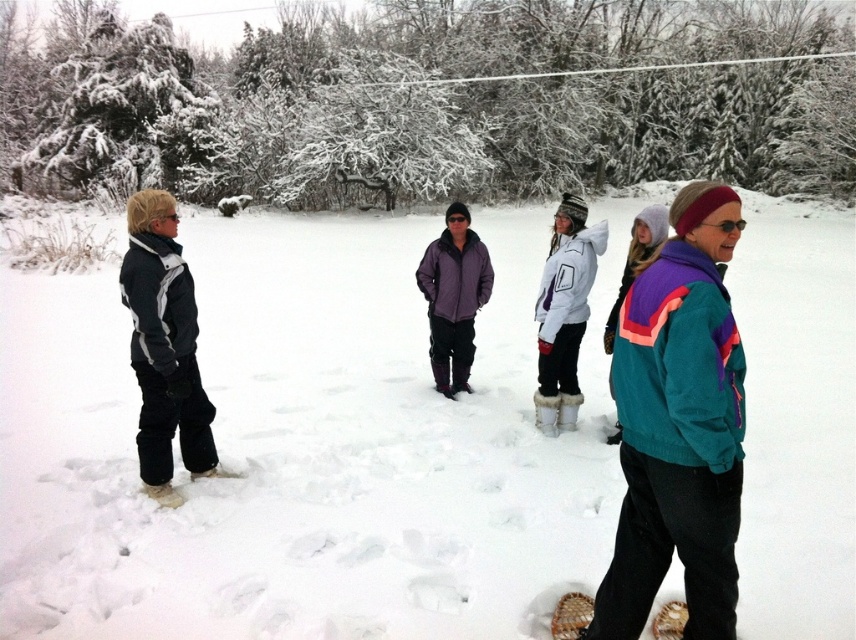
Is purple quilted jacket at center bigger than white fur snowshoe at lower center?

Yes.

Is purple quilted jacket at center wider than white fur snowshoe at lower center?

Yes, purple quilted jacket at center is wider than white fur snowshoe at lower center.

Between point (443, 282) and point (562, 416), which one is positioned in front?

Point (562, 416)

Locate an element on the screen. Image resolution: width=856 pixels, height=640 pixels. purple quilted jacket at center is located at coordinates (453, 298).

Between dark gray fleece jacket at left and white fur snowshoe at lower center, which one is positioned lower?

white fur snowshoe at lower center is lower down.

Does point (200, 476) come closer to viewer compared to point (574, 401)?

Yes.

Which is behind, point (135, 365) or point (563, 396)?

The point (563, 396) is more distant.

Where is `dark gray fleece jacket at left`? This screenshot has width=856, height=640. dark gray fleece jacket at left is located at coordinates (164, 342).

Is white fleece jacket at center taller than purple quilted jacket at center?

Correct, white fleece jacket at center is much taller as purple quilted jacket at center.

Can you confirm if white fleece jacket at center is positioned above purple quilted jacket at center?

No.

Measure the distance between point (587, 308) and camera.

The distance of point (587, 308) from camera is 6.03 meters.

Where is `white fleece jacket at center`? white fleece jacket at center is located at coordinates (563, 312).